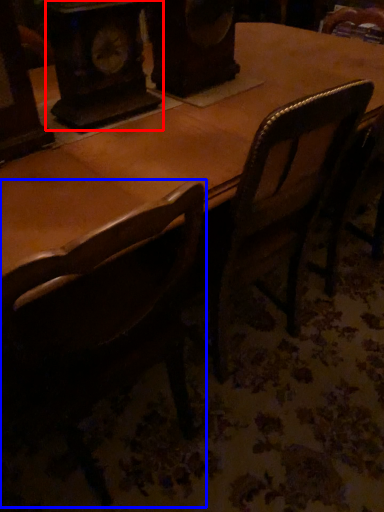
Question: Which point is further to the camera, clock (highlighted by a red box) or chair (highlighted by a blue box)?

Choices:
 (A) clock
 (B) chair

Answer: (A)